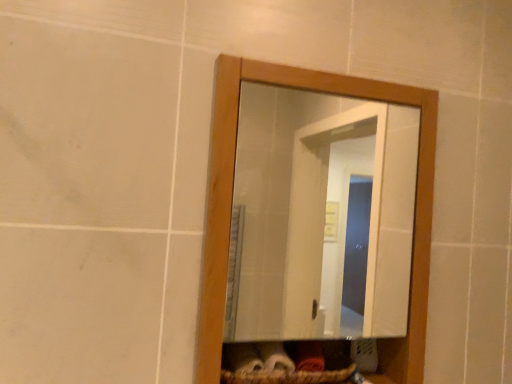
Locate an element on the screen. Image resolution: width=512 pixels, height=384 pixels. wooden mirror at center is located at coordinates (321, 216).

The height and width of the screenshot is (384, 512). Describe the element at coordinates (321, 216) in the screenshot. I see `wooden mirror at center` at that location.

The height and width of the screenshot is (384, 512). Find the location of `brown woven basket at lower center`. brown woven basket at lower center is located at coordinates (296, 374).

Describe the element at coordinates (296, 374) in the screenshot. I see `brown woven basket at lower center` at that location.

Measure the distance between brown woven basket at lower center and camera.

brown woven basket at lower center and camera are 38.11 inches apart.

You are a GUI agent. You are given a task and a screenshot of the screen. Output one action in this format:
    pyautogui.click(x=<x>, y=<y>)
    Task: Click on the wooden mirror at center
    
    Given the screenshot: What is the action you would take?
    pyautogui.click(x=321, y=216)

Looking at this image, considering the positions of objects wooden mirror at center and brown woven basket at lower center in the image provided, who is more to the right, wooden mirror at center or brown woven basket at lower center?

wooden mirror at center.

Between wooden mirror at center and brown woven basket at lower center, which one is positioned behind?

Positioned behind is brown woven basket at lower center.

Considering the points (349, 149) and (346, 379), which point is in front, point (349, 149) or point (346, 379)?

The point (346, 379) is in front.

From the image's perspective, between wooden mirror at center and brown woven basket at lower center, who is located below?

brown woven basket at lower center.

From a real-world perspective, between wooden mirror at center and brown woven basket at lower center, who is vertically higher?

In real-world perspective, wooden mirror at center is above.

Can you confirm if wooden mirror at center is wider than brown woven basket at lower center?

No, wooden mirror at center is not wider than brown woven basket at lower center.

Which of these two, wooden mirror at center or brown woven basket at lower center, stands shorter?

brown woven basket at lower center is shorter.

Who is bigger, wooden mirror at center or brown woven basket at lower center?

Bigger between the two is wooden mirror at center.

Is wooden mirror at center outside of brown woven basket at lower center?

Yes.

Is there a large distance between wooden mirror at center and brown woven basket at lower center?

Absolutely, wooden mirror at center is distant from brown woven basket at lower center.

Is wooden mirror at center oriented away from brown woven basket at lower center?

Yes, brown woven basket at lower center is at the back of wooden mirror at center.

From the picture: How far apart are wooden mirror at center and brown woven basket at lower center?

wooden mirror at center is 3.76 feet away from brown woven basket at lower center.

This screenshot has width=512, height=384. I want to click on mirror that appears above the brown woven basket at lower center (from the image's perspective), so click(321, 216).

From the picture: Is brown woven basket at lower center to the right of wooden mirror at center from the viewer's perspective?

No.

Does brown woven basket at lower center lie in front of wooden mirror at center?

That is False.

Is point (317, 380) behind point (292, 241)?

No, (317, 380) is in front of (292, 241).

From the image's perspective, would you say brown woven basket at lower center is positioned over wooden mirror at center?

Actually, brown woven basket at lower center appears below wooden mirror at center in the image.

From a real-world perspective, is brown woven basket at lower center on top of wooden mirror at center?

Actually, brown woven basket at lower center is physically below wooden mirror at center in the real world.

Looking at their sizes, would you say brown woven basket at lower center is wider or thinner than wooden mirror at center?

Clearly, brown woven basket at lower center has more width compared to wooden mirror at center.

From their relative heights in the image, would you say brown woven basket at lower center is taller or shorter than wooden mirror at center?

In the image, brown woven basket at lower center appears to be shorter than wooden mirror at center.

Between brown woven basket at lower center and wooden mirror at center, which one has larger size?

Bigger between the two is wooden mirror at center.

Would you say brown woven basket at lower center is outside wooden mirror at center?

brown woven basket at lower center is positioned outside wooden mirror at center.

Consider the image. Would you consider brown woven basket at lower center to be distant from wooden mirror at center?

Indeed, brown woven basket at lower center is not near wooden mirror at center.

Is brown woven basket at lower center aimed at wooden mirror at center?

Yes.

How many degrees apart are the facing directions of brown woven basket at lower center and wooden mirror at center?

brown woven basket at lower center and wooden mirror at center are facing 0.00319 degrees away from each other.

Image resolution: width=512 pixels, height=384 pixels. What are the coordinates of `basket located on the left of wooden mirror at center` in the screenshot? It's located at (296, 374).

I want to click on mirror located in front of the brown woven basket at lower center, so click(x=321, y=216).

The width and height of the screenshot is (512, 384). In the image, there is a wooden mirror at center. What are the coordinates of `basket below it (from a real-world perspective)` in the screenshot? It's located at tap(296, 374).